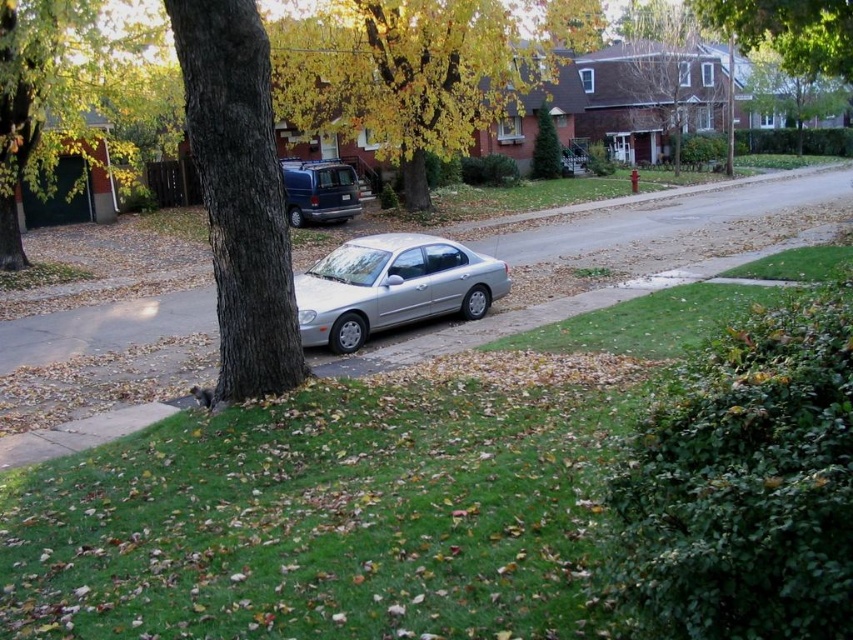
You are a delivery person trying to park your van near the silver metallic sedan at center and the brown wood tree at upper center. Since your van is larger than both, which object should you avoid to prevent blocking the driveway?

You should avoid blocking the brown wood tree at upper center because the silver metallic sedan at center occupies less space than the brown wood tree at upper center, meaning the sedan takes up less area and might be easier to maneuver around without obstructing the driveway.

You are a delivery person trying to park your vehicle in this suburban area. You see the silver metallic sedan at center and the brown wood tree at upper center. Which object is closer to you as you approach the scene?

The silver metallic sedan at center is closer to you because it is in front of the brown wood tree at upper center.